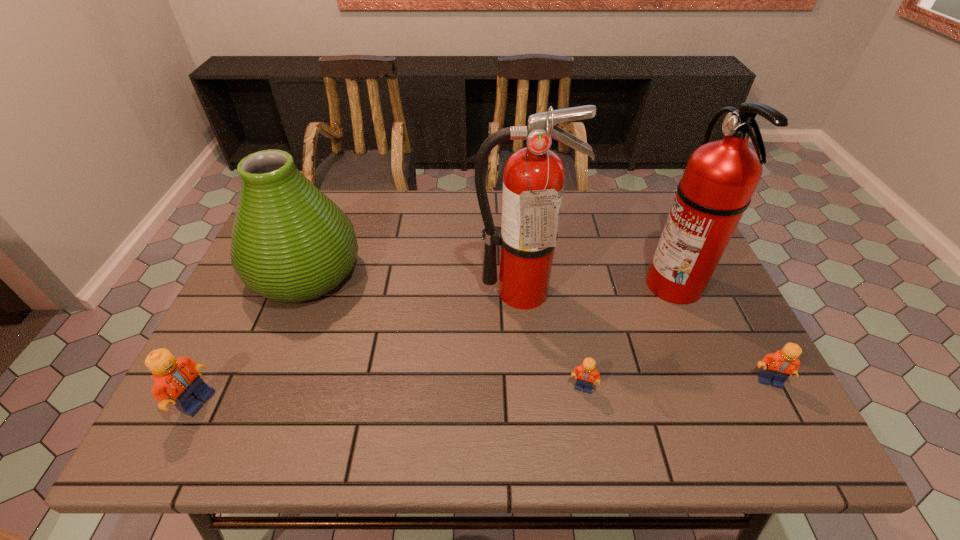
In order to click on vacant space in between the second object from right to left and the left fire extinguisher in this screenshot , I will do `click(597, 287)`.

I want to click on empty space that is in between the third tallest object and the tallest Lego, so click(x=252, y=337).

Find the location of `free space between the left fire extinguisher and the shortest Lego`. free space between the left fire extinguisher and the shortest Lego is located at coordinates (552, 339).

Where is `vacant region between the second Lego from right to left and the rightmost Lego`? The height and width of the screenshot is (540, 960). vacant region between the second Lego from right to left and the rightmost Lego is located at coordinates (676, 384).

Find the location of `free space between the fourth shortest object and the second Lego from right to left`. free space between the fourth shortest object and the second Lego from right to left is located at coordinates (x=444, y=330).

The height and width of the screenshot is (540, 960). In order to click on object that is the third closest to the fifth object from left to right in this screenshot , I will do `click(587, 375)`.

Identify which object is the second nearest to the third tallest object. Please provide its 2D coordinates. Your answer should be formatted as a tuple, i.e. [(x, y)], where the tuple contains the x and y coordinates of a point satisfying the conditions above.

[(533, 180)]

This screenshot has width=960, height=540. I want to click on Lego that is the closest to the third shortest object, so click(x=587, y=375).

Identify the location of the second closest Lego to the right fire extinguisher. This screenshot has width=960, height=540. (587, 375).

The width and height of the screenshot is (960, 540). I want to click on vacant space that satisfies the following two spatial constraints: 1. on the front-facing side of the shortest object; 2. on the front-facing side of the fourth tallest object, so click(586, 402).